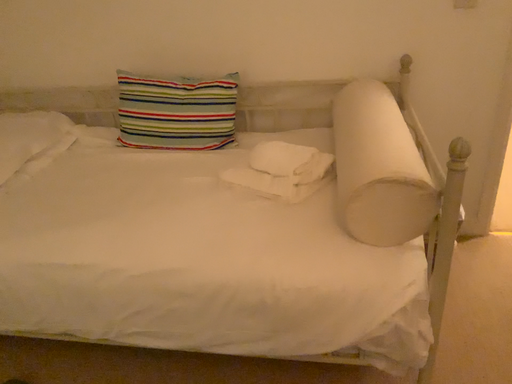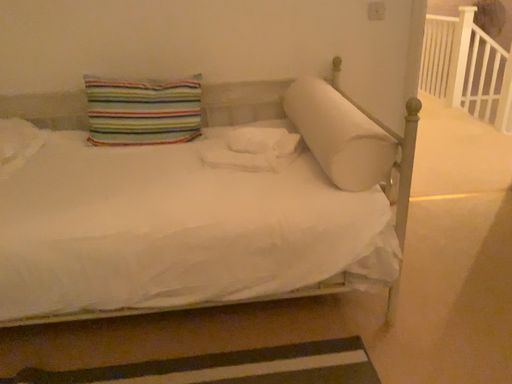
Question: Which way did the camera rotate in the video?

Choices:
 (A) rotated right
 (B) rotated left

Answer: (A)